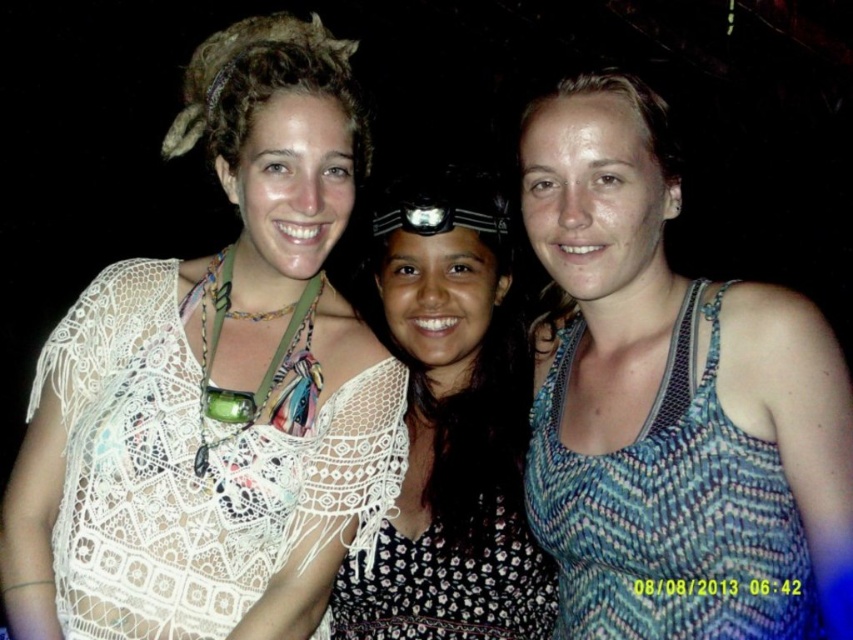
Based on the scene description, which clothing item is taller between the black lace dress at center and the blue woven tank top at right?

The black lace dress at center is taller than the blue woven tank top at right.

You are a photographer trying to adjust the lighting for a group photo. You notice the white lace top at upper left and the blue woven tank top at right. Which top should you focus the light on to ensure it stands out more due to its size?

The white lace top at upper left is larger in size than the blue woven tank top at right, so focusing the light on the white lace top at upper left would make it stand out more due to its size.